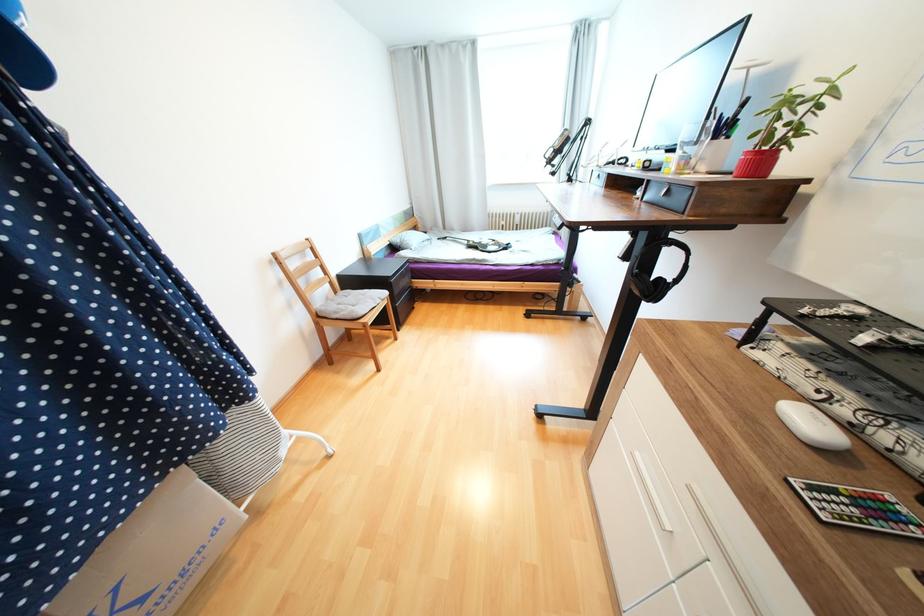
Find where to lift the black electric guitar. Please return your answer as a coordinate pair (x, y).

(479, 243)